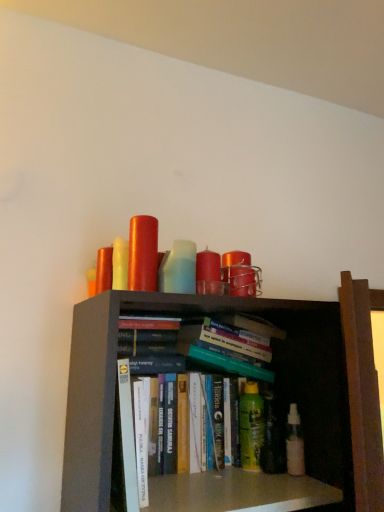
Identify the location of hardcover books at center. (223, 347).

Describe the element at coordinates (223, 347) in the screenshot. I see `hardcover books at center` at that location.

Find the location of a particular element. The width and height of the screenshot is (384, 512). hardcover books at center is located at coordinates (223, 347).